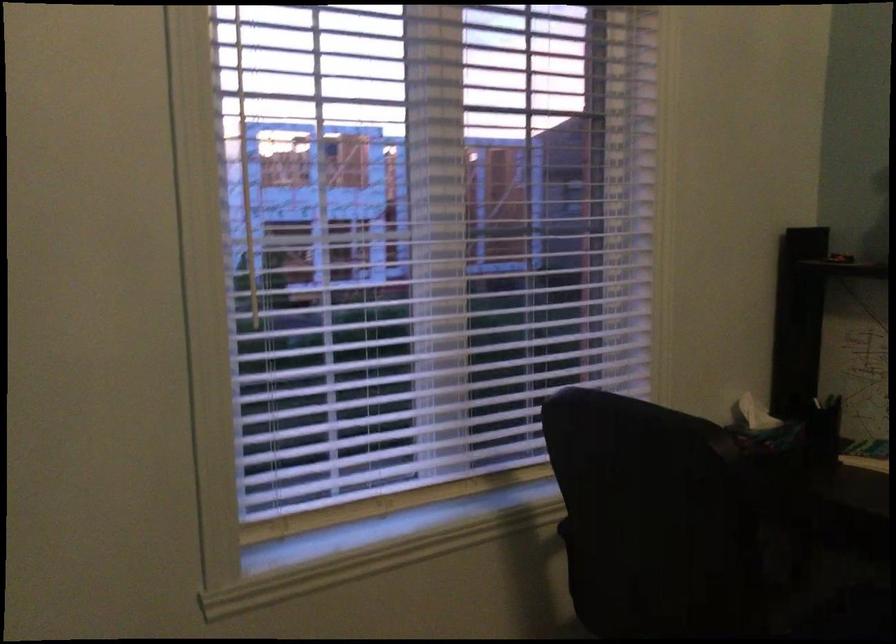
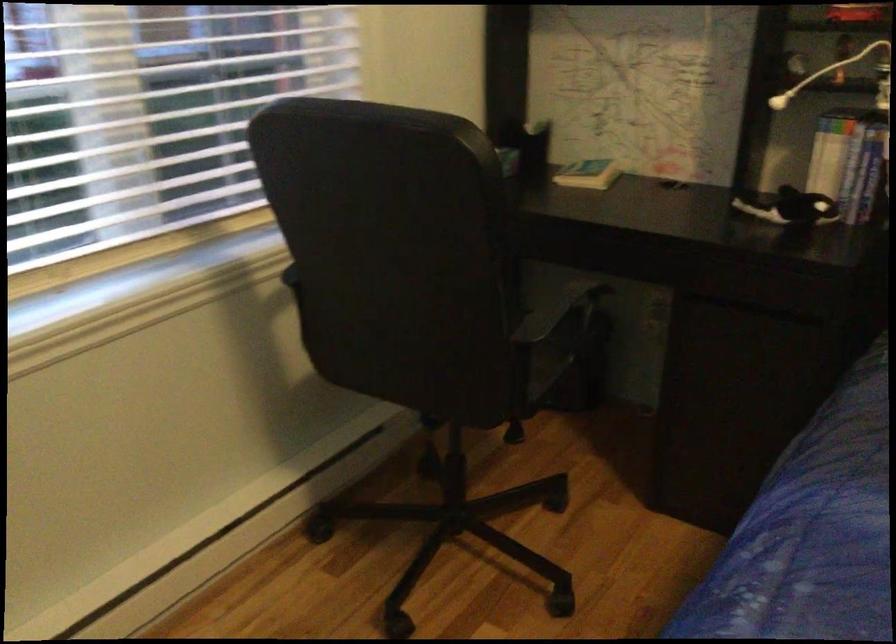
The first image is from the beginning of the video and the second image is from the end. How did the camera likely rotate when shooting the video?

The camera rotated toward right-down.